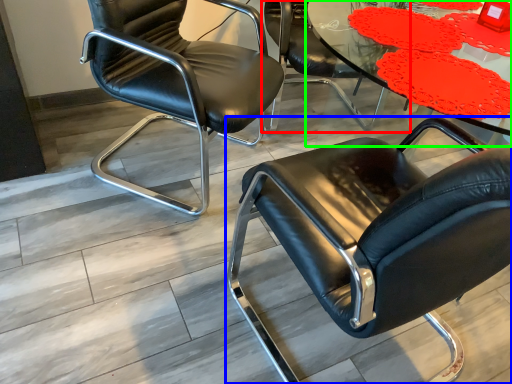
Question: Which object is the closest to the chair (highlighted by a red box)? Choose among these: chair (highlighted by a blue box) or table (highlighted by a green box).

Choices:
 (A) chair
 (B) table

Answer: (B)